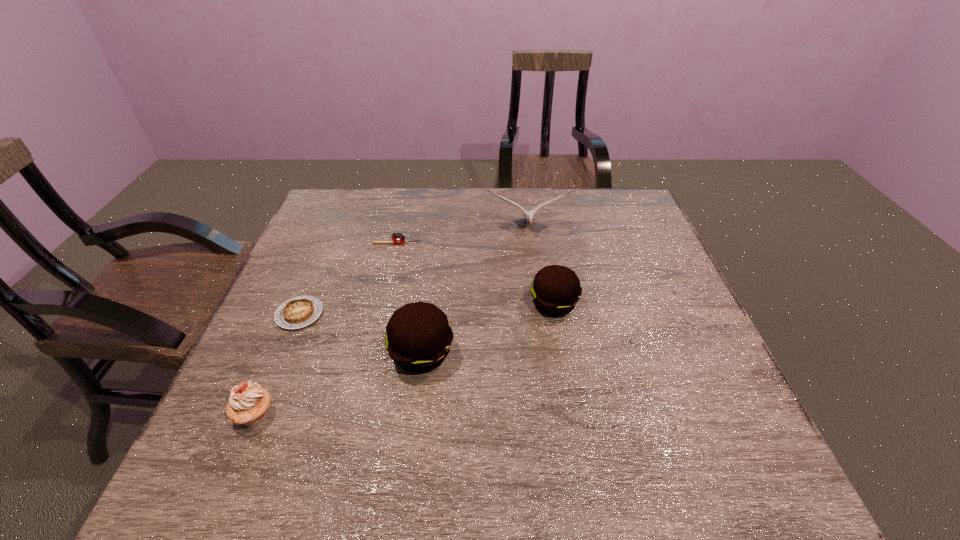
Locate an element on the screen. The image size is (960, 540). object that is at the near left corner is located at coordinates [x=249, y=404].

The width and height of the screenshot is (960, 540). What are the coordinates of `vacant space at the far edge of the desktop` in the screenshot? It's located at (377, 214).

Identify the location of free space at the left edge of the desktop. (309, 236).

Where is `free space at the right edge of the desktop`? free space at the right edge of the desktop is located at coordinates (604, 235).

This screenshot has width=960, height=540. I want to click on vacant space at the far left corner of the desktop, so click(x=334, y=200).

Identify the location of unoccupied position between the nearest object and the tape measure. Image resolution: width=960 pixels, height=540 pixels. (325, 329).

In order to click on vacant area that lies between the cupcake and the nearer patty in this screenshot , I will do `click(338, 384)`.

At what (x,y) coordinates should I click in order to perform the action: click on empty location between the tape measure and the gull. Please return your answer as a coordinate pair (x, y). Image resolution: width=960 pixels, height=540 pixels. Looking at the image, I should click on (463, 236).

The image size is (960, 540). I want to click on free space between the nearer patty and the nearest object, so click(338, 384).

Image resolution: width=960 pixels, height=540 pixels. Identify the location of vacant area that lies between the nearest object and the shortest object. (277, 364).